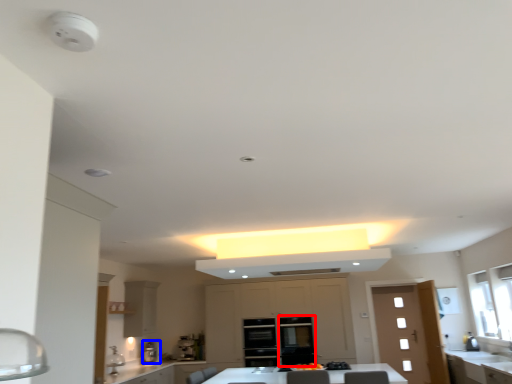
Question: Which of the following is the closest to the observer, glass door (highlighted by a red box) or coffee machine (highlighted by a blue box)?

Choices:
 (A) glass door
 (B) coffee machine

Answer: (A)